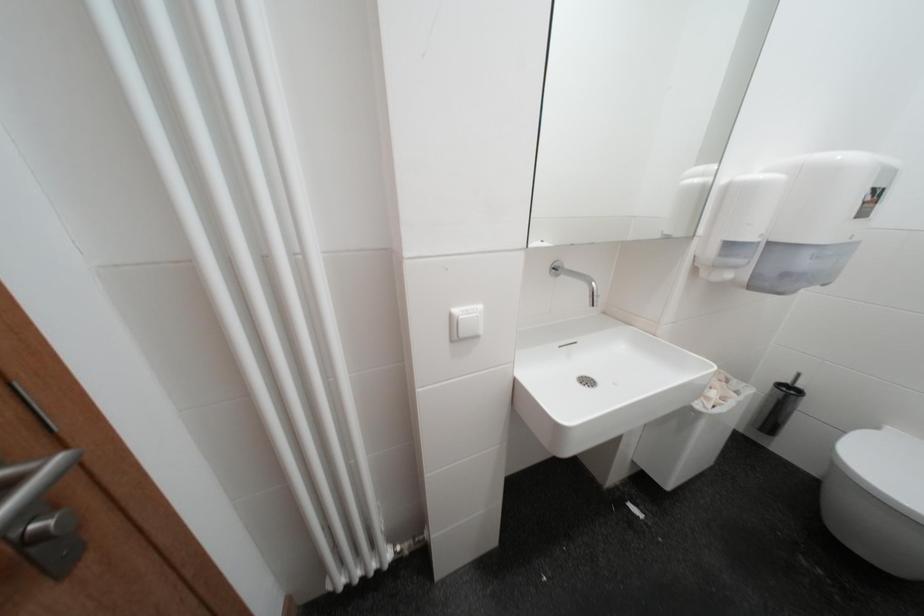
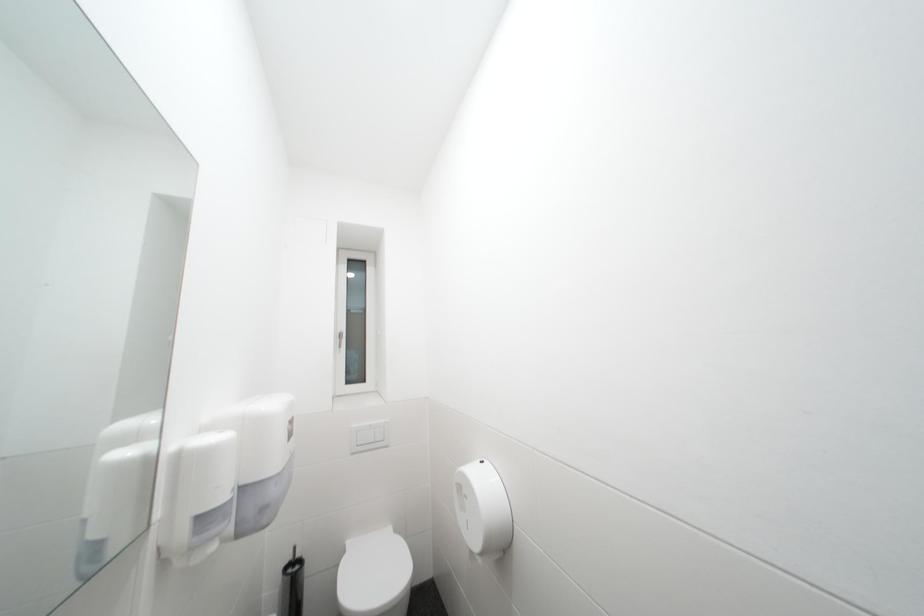
Question: The camera is either moving clockwise (left) or counter-clockwise (right) around the object. The first image is from the beginning of the video and the second image is from the end. Is the camera moving left or right when shooting the video?

Choices:
 (A) Left
 (B) Right

Answer: (A)